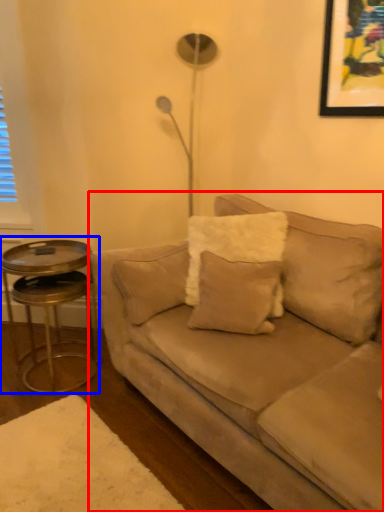
Question: Among these objects, which one is farthest to the camera, studio couch (highlighted by a red box) or table (highlighted by a blue box)?

Choices:
 (A) studio couch
 (B) table

Answer: (B)